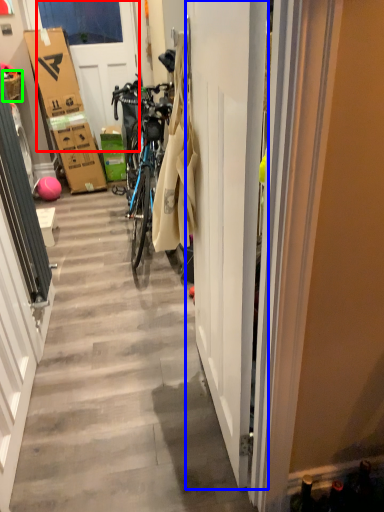
Question: Based on their relative distances, which object is nearer to door (highlighted by a red box)? Choose from door (highlighted by a blue box) and picnic basket (highlighted by a green box).

Choices:
 (A) door
 (B) picnic basket

Answer: (B)